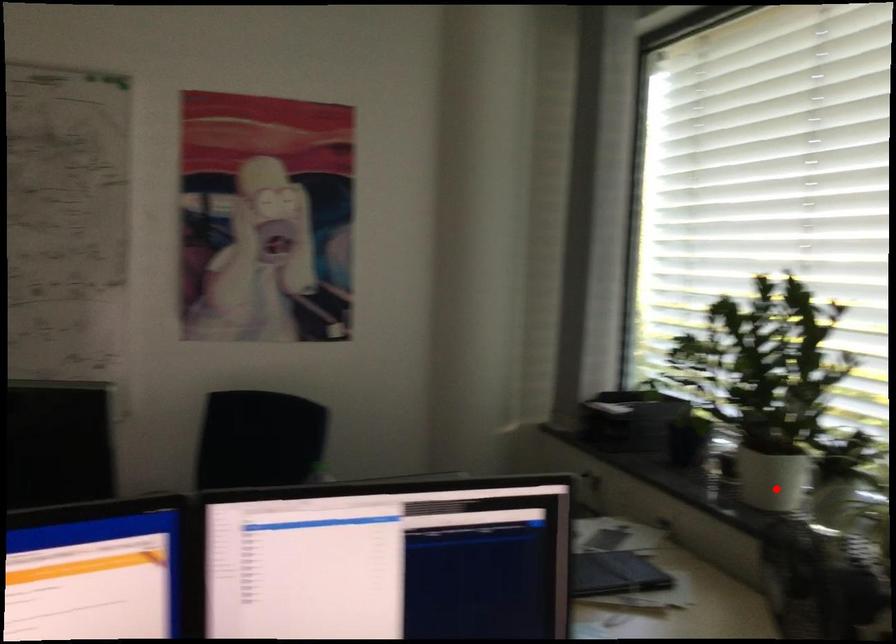
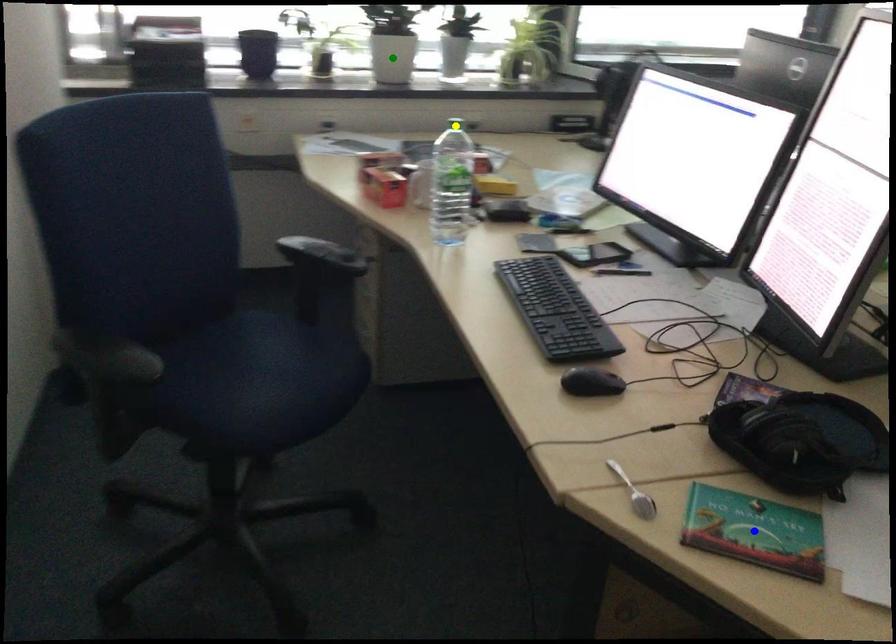
Question: I am providing you with two images of the same scene from different viewpoints. A red point is marked on the first image. You are given multiple points on the second image. Which spot in image 2 lines up with the point in image 1?

Choices:
 (A) yellow point
 (B) blue point
 (C) green point

Answer: (C)